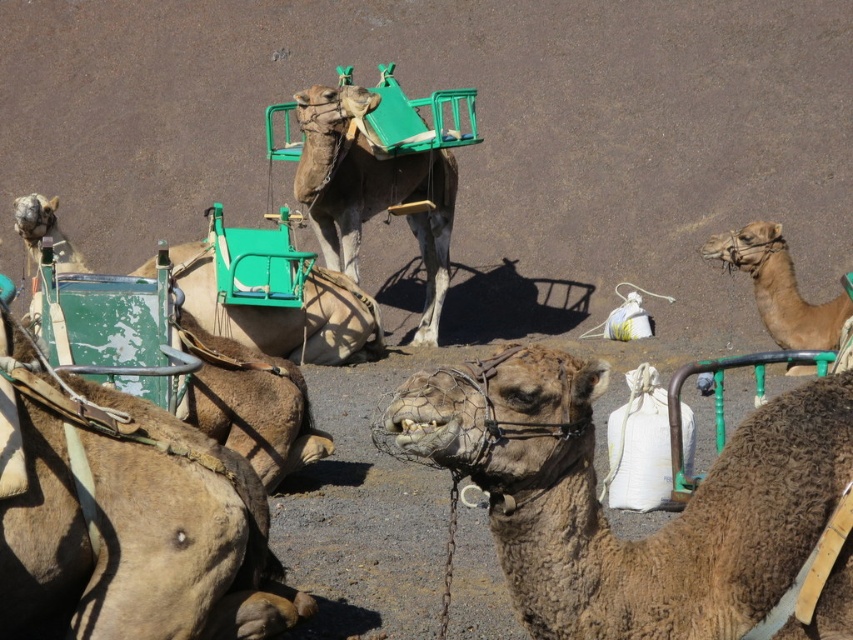
Question: Which of the following is the farthest from the observer?

Choices:
 (A) (103, 401)
 (B) (766, 330)
 (C) (78, 266)

Answer: (C)

Question: In this image, where is brown rough camel at center located relative to light brown fur camel at right?

Choices:
 (A) right
 (B) left

Answer: (B)

Question: Which point is farther to the camera?

Choices:
 (A) (712, 464)
 (B) (299, 161)

Answer: (B)

Question: Estimate the real-world distances between objects in this image. Which object is farther from the brown fuzzy camel at center?

Choices:
 (A) brown rough camel at center
 (B) light brown fur camel at right
 (C) brown textured camel at center

Answer: (C)

Question: Can you confirm if light brown leather camel at upper left is positioned below light brown fur camel at right?

Choices:
 (A) no
 (B) yes

Answer: (B)

Question: Does light brown leather camel at upper left appear over light brown fur camel at right?

Choices:
 (A) yes
 (B) no

Answer: (B)